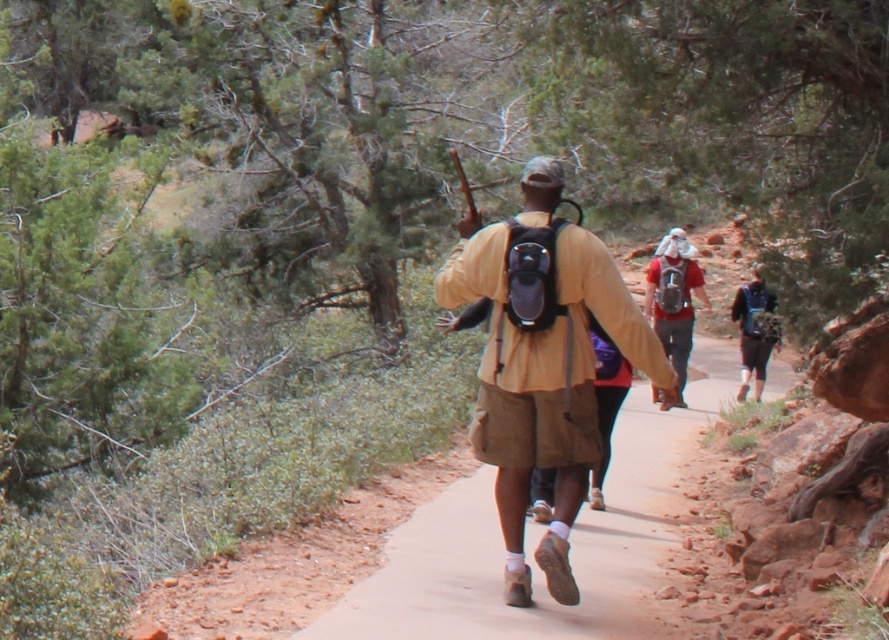
Question: Does matte blue backpack at center appear over matte black backpack at center?

Choices:
 (A) no
 (B) yes

Answer: (A)

Question: Is brown dirt path at center closer to camera compared to red fabric backpack at center?

Choices:
 (A) no
 (B) yes

Answer: (B)

Question: Which of the following is the farthest from the observer?

Choices:
 (A) matte khaki shirt at center
 (B) red fabric backpack at center
 (C) brown dirt path at center

Answer: (B)

Question: Which object is positioned closest to the matte black backpack at center?

Choices:
 (A) brown dirt path at center
 (B) red fabric backpack at center

Answer: (B)

Question: Considering the relative positions of matte khaki shirt at center and matte black backpack at center in the image provided, where is matte khaki shirt at center located with respect to matte black backpack at center?

Choices:
 (A) below
 (B) above

Answer: (A)

Question: Which object appears farthest from the camera in this image?

Choices:
 (A) matte khaki shirt at center
 (B) matte black backpack at center
 (C) red fabric backpack at center

Answer: (B)